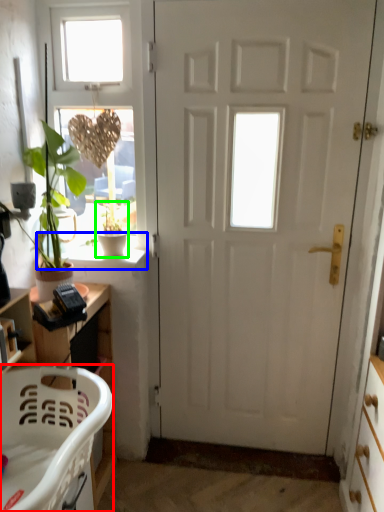
Question: Which is nearer to the chair (highlighted by a red box)? window sill (highlighted by a blue box) or houseplant (highlighted by a green box).

Choices:
 (A) window sill
 (B) houseplant

Answer: (A)